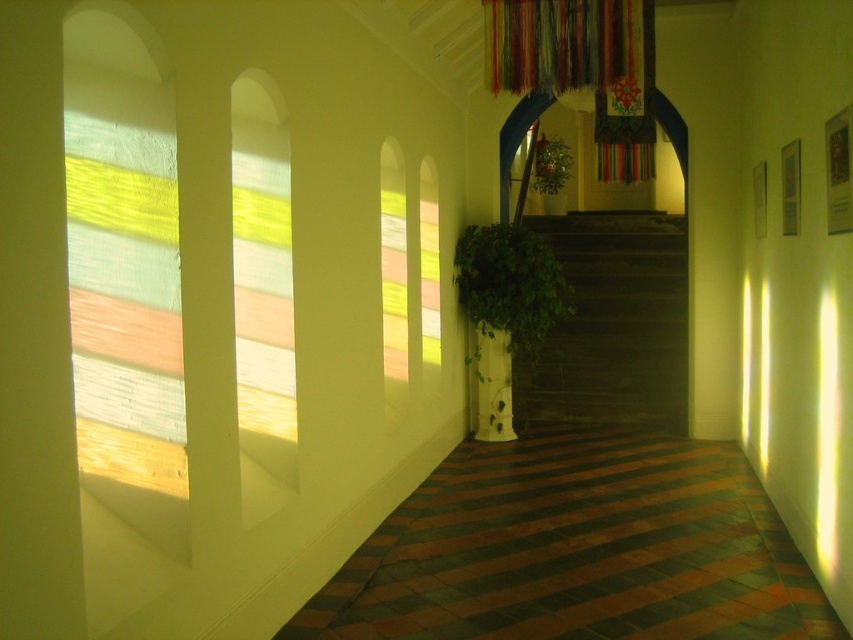
You are standing in the hallway and want to go upstairs. Where should you head to find the dark wood stairs at center?

The dark wood stairs at center are located at the central part of the hallway, so you should head towards the center of the hallway to find them.

You are a delivery person carrying a large package that is 2 meters long. You need to navigate through the hallway and pass between the multicolored fabric curtain at upper center and the green leafy plant at center. Can you fit through the space between them without tilting the package?

The distance between the multicolored fabric curtain at upper center and the green leafy plant at center is 6.72 meters. Since your package is only 2 meters long, there is ample space to pass through without tilting it.